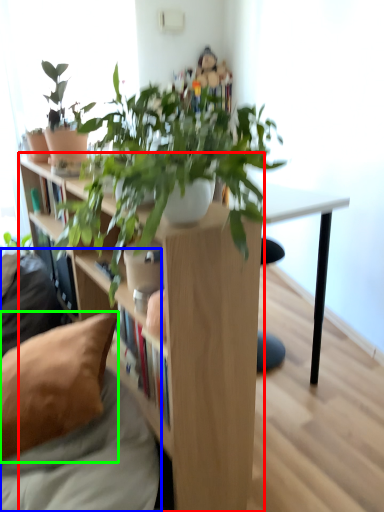
Question: Estimate the real-world distances between objects in this image. Which object is farther from shelf (highlighted by a red box), couch (highlighted by a blue box) or pillow (highlighted by a green box)?

Choices:
 (A) couch
 (B) pillow

Answer: (B)